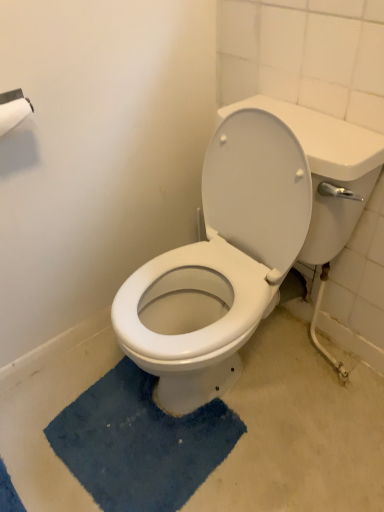
Find the location of a particular element. The image size is (384, 512). vacant space situated above blue plush bath mat at lower center (from a real-world perspective) is located at coordinates (136, 428).